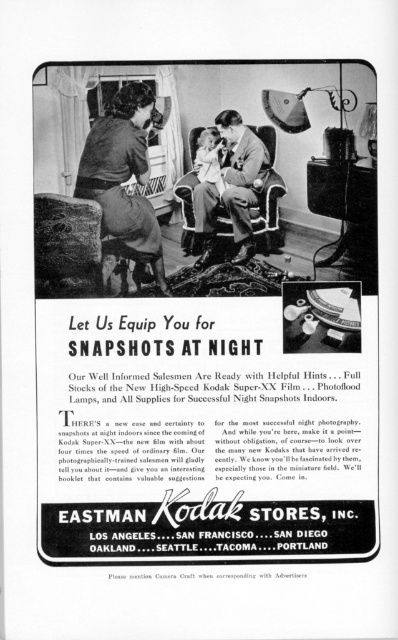
Can you confirm if matte black dress at upper left is positioned to the left of matte black suit at center?

Correct, you'll find matte black dress at upper left to the left of matte black suit at center.

Where is `matte black dress at upper left`? This screenshot has width=398, height=640. matte black dress at upper left is located at coordinates (124, 173).

At what (x,y) coordinates should I click in order to perform the action: click on matte black dress at upper left. Please return your answer as a coordinate pair (x, y). This screenshot has width=398, height=640. Looking at the image, I should click on (124, 173).